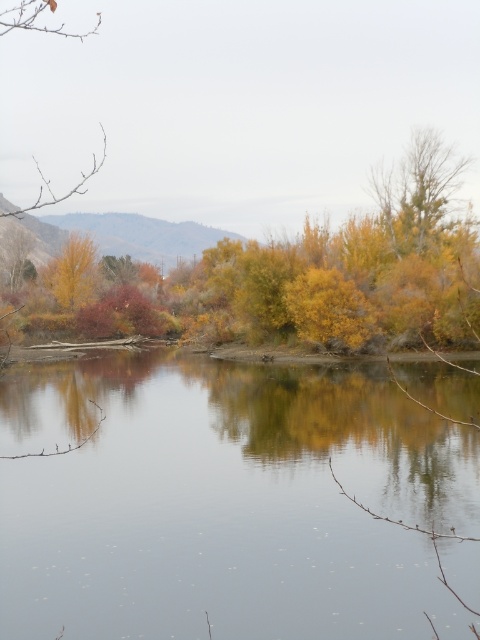
You are an artist sketching the autumn landscape. You notice the transparent water at center and the yellow matte tree at upper left. Which object is positioned higher in the scene?

The yellow matte tree at upper left is positioned higher in the scene than the transparent water at center, as it is located above it.

You are an artist planning to paint the autumn landscape. You need to decide the size of your canvas. Given the transparent water at center and the yellow matte tree at upper left, which object should you allocate more space to in your painting?

The transparent water at center should be allocated more space in the painting because its width is larger than the yellow matte tree at upper left according to the description.

You are standing in the autumn landscape and want to take a photo of the transparent water at center and the yellow matte tree at upper left. Which object should you focus on first if you want both to be in sharp focus?

You should focus on the yellow matte tree at upper left first because it is farther away from the viewer than the transparent water at center, ensuring both will be in focus when using depth of field.